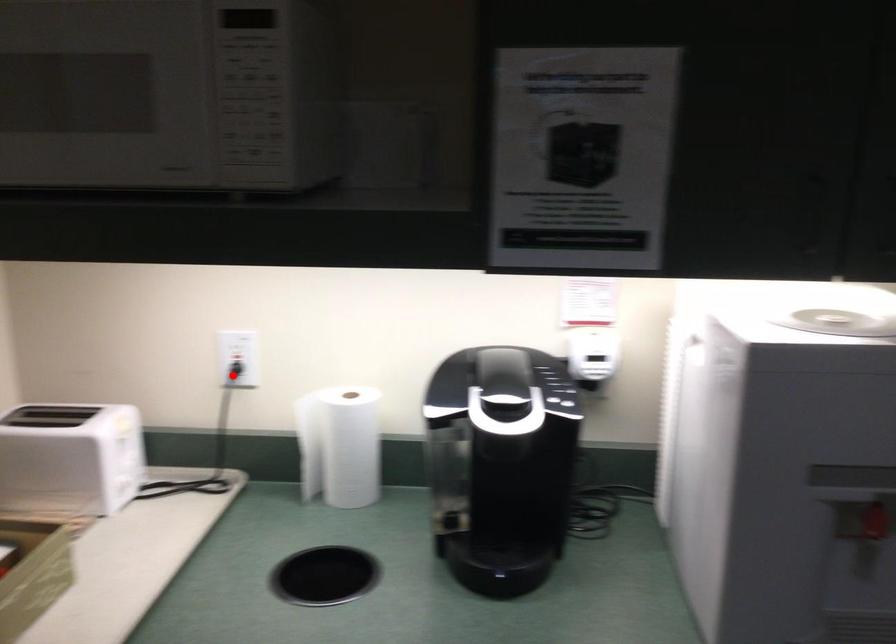
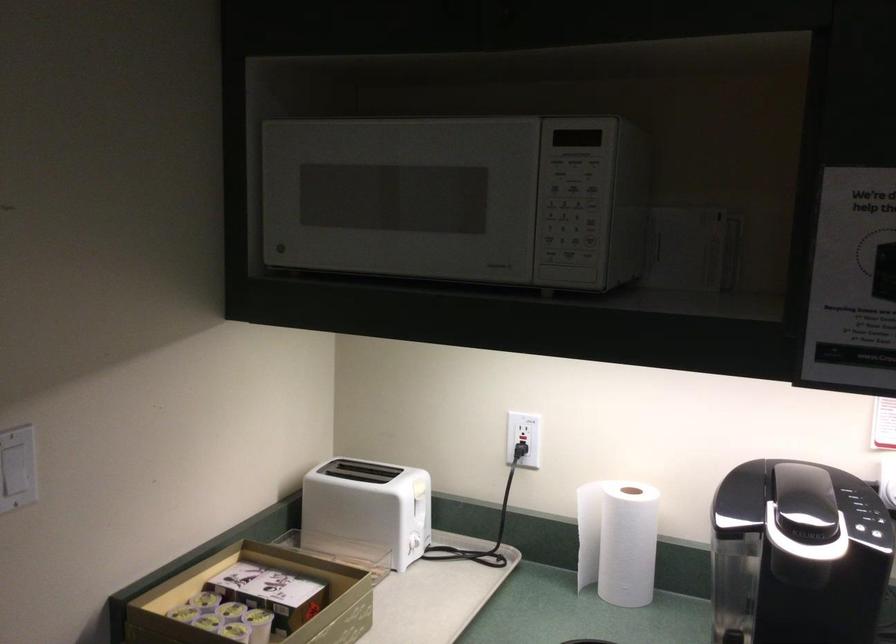
In the second image, find the point that corresponds to the highlighted location in the first image.

(521, 456)